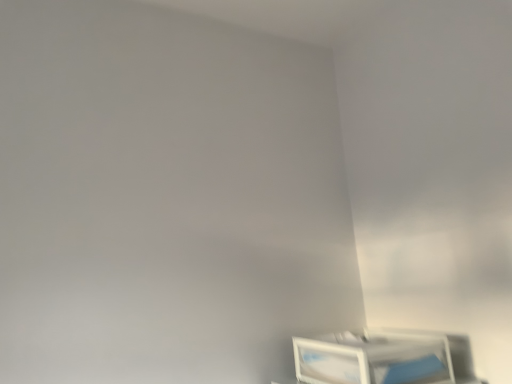
The width and height of the screenshot is (512, 384). Identify the location of white glossy picture frame at lower right. (385, 358).

Measure the distance between point (451, 356) and camera.

Point (451, 356) is 1.09 meters from camera.

This screenshot has width=512, height=384. Describe the element at coordinates (385, 358) in the screenshot. I see `white glossy picture frame at lower right` at that location.

Locate an element on the screen. white glossy picture frame at lower right is located at coordinates (385, 358).